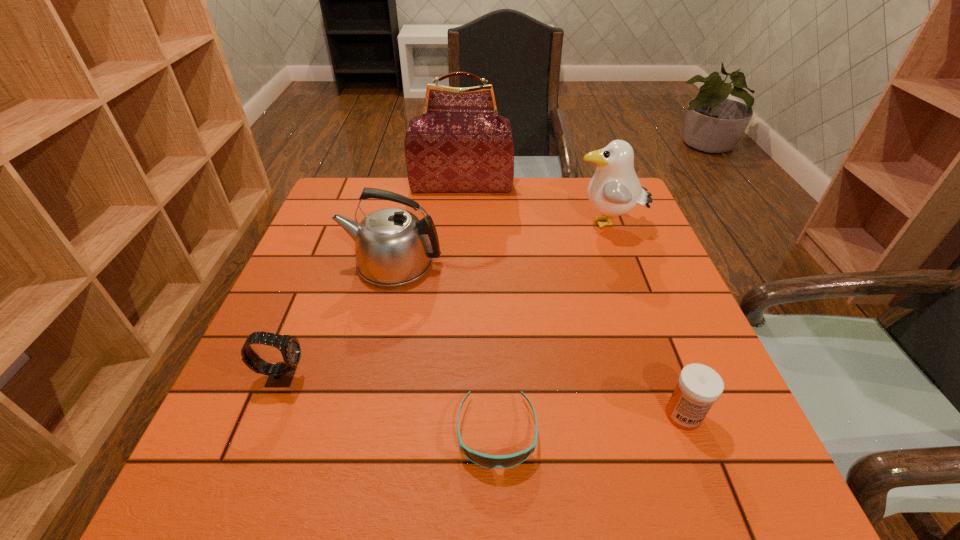
You are a GUI agent. You are given a task and a screenshot of the screen. Output one action in this format:
    pyautogui.click(x=<x>, y=<y>)
    Task: Click on the empty location between the gull and the medicine
    The image size is (960, 540).
    Given the screenshot: What is the action you would take?
    pyautogui.click(x=645, y=320)

Where is `free area in between the fourth shortest object and the medicine`? This screenshot has width=960, height=540. free area in between the fourth shortest object and the medicine is located at coordinates (538, 340).

This screenshot has width=960, height=540. Find the location of `free spot between the shortest object and the medicine`. free spot between the shortest object and the medicine is located at coordinates (589, 424).

You are a GUI agent. You are given a task and a screenshot of the screen. Output one action in this format:
    pyautogui.click(x=<x>, y=<y>)
    Task: Click on the vacant area between the watch and the third tallest object
    Image resolution: width=960 pixels, height=540 pixels.
    Given the screenshot: What is the action you would take?
    pyautogui.click(x=338, y=320)

You are a GUI agent. You are given a task and a screenshot of the screen. Output one action in this format:
    pyautogui.click(x=<x>, y=<y>)
    Task: Click on the free space between the gull and the sunglasses
    This screenshot has height=540, width=960.
    Given the screenshot: What is the action you would take?
    pyautogui.click(x=552, y=328)

Find the location of a particular element. This screenshot has height=540, width=960. free spot between the sunglasses and the third nearest object is located at coordinates (390, 404).

The width and height of the screenshot is (960, 540). In order to click on vacant area that lies between the medicine and the sunglasses in this screenshot , I will do `click(589, 424)`.

Choose which object is the nearest neighbor to the farthest object. Please provide its 2D coordinates. Your answer should be formatted as a tuple, i.e. [(x, y)], where the tuple contains the x and y coordinates of a point satisfying the conditions above.

[(614, 190)]

Locate an element on the screen. The image size is (960, 540). the second closest object to the fourth farthest object is located at coordinates (487, 461).

Where is `blank space that satisfies the following two spatial constraints: 1. on the front-facing side of the medicine; 2. on the left side of the farthest object`? blank space that satisfies the following two spatial constraints: 1. on the front-facing side of the medicine; 2. on the left side of the farthest object is located at coordinates (448, 415).